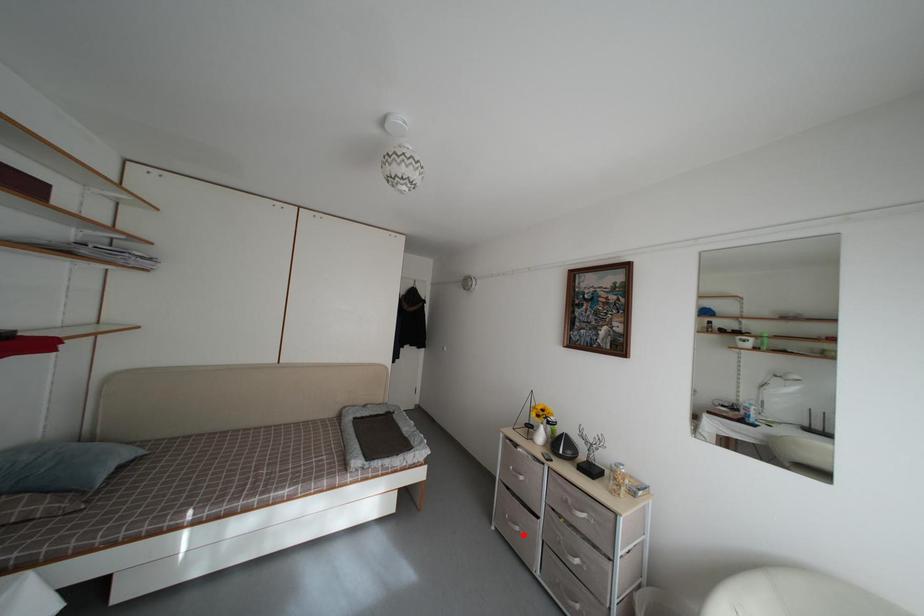
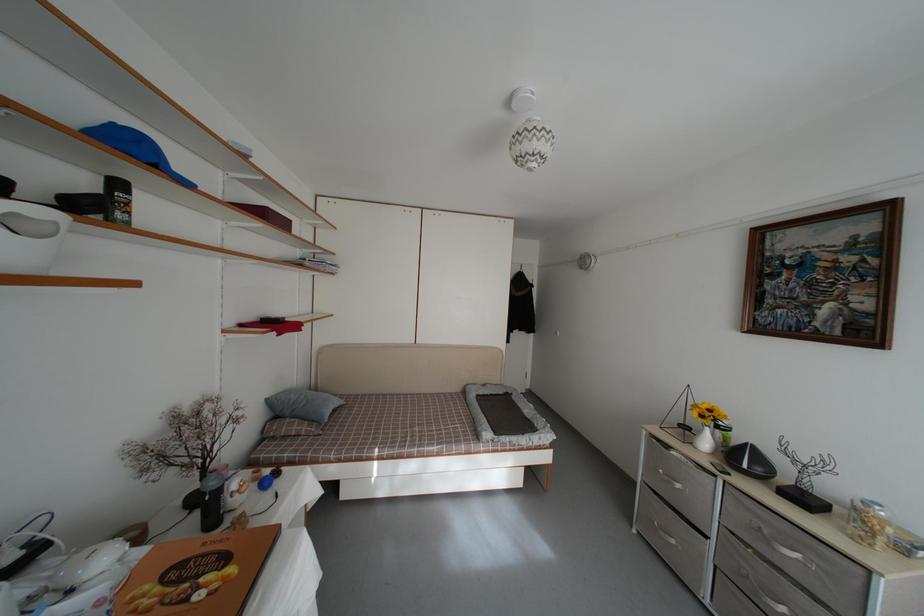
Where in the second image is the point corresponding to the highlighted location from the first image?

(678, 548)